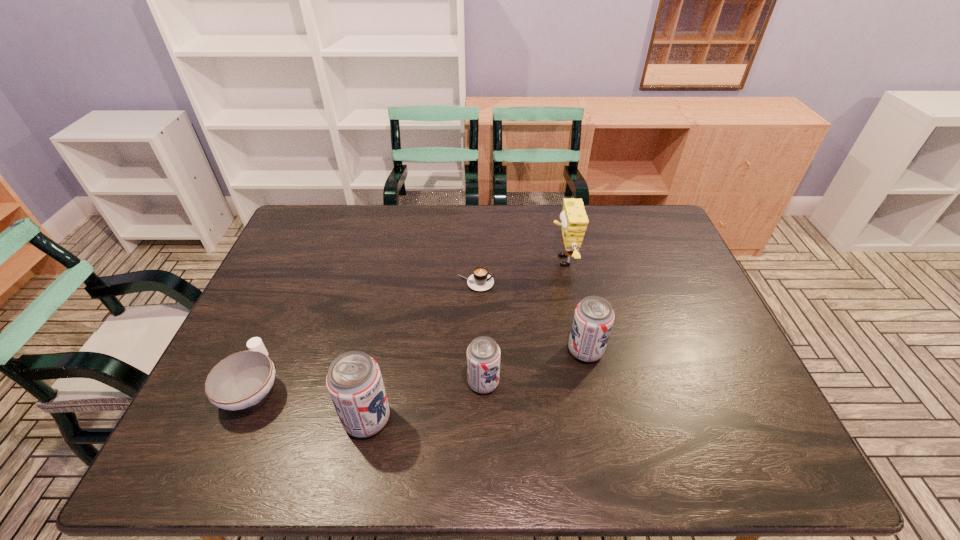
Given the evenly spaced beer cans in the image, where should an extra beer can be added on the right to preserve the spacing? Please point to a vacant space. Please provide its 2D coordinates. Your answer should be formatted as a tuple, i.e. [(x, y)], where the tuple contains the x and y coordinates of a point satisfying the conditions above.

[(676, 322)]